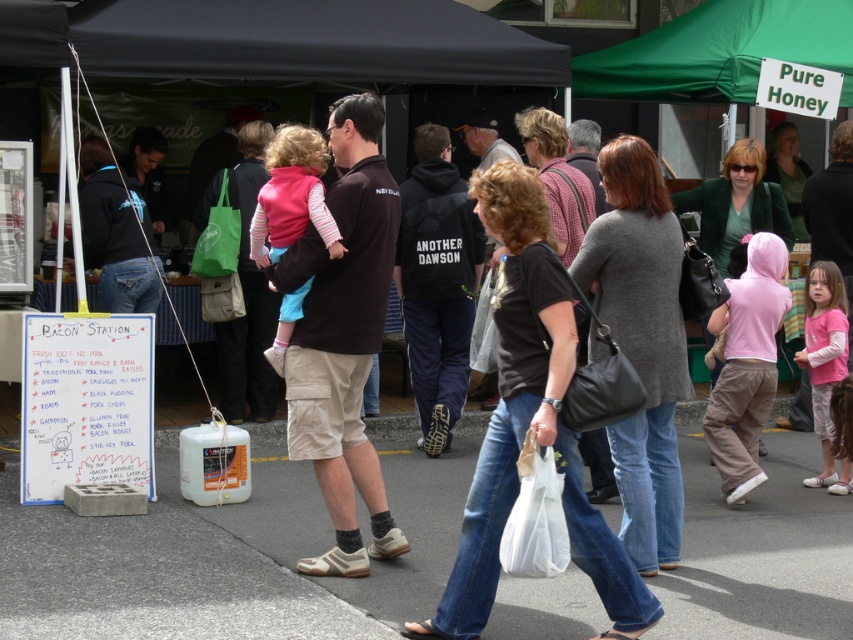
Does gray asphalt pavement at lower center lie behind gray knitted sweater at center?

That is False.

Is gray asphalt pavement at lower center thinner than gray knitted sweater at center?

No.

Between point (465, 445) and point (660, 179), which one is positioned behind?

The point (465, 445) is more distant.

The image size is (853, 640). What are the coordinates of `gray asphalt pavement at lower center` in the screenshot? It's located at click(x=225, y=557).

Based on the photo, can you confirm if gray asphalt pavement at lower center is wider than green matte jacket at upper center?

Indeed, gray asphalt pavement at lower center has a greater width compared to green matte jacket at upper center.

Looking at this image, between gray asphalt pavement at lower center and green matte jacket at upper center, which one is positioned lower?

gray asphalt pavement at lower center

Does point (0, 534) come farther from viewer compared to point (778, 148)?

No, it is in front of (778, 148).

I want to click on gray asphalt pavement at lower center, so click(x=225, y=557).

Describe the element at coordinates (531, 422) in the screenshot. This screenshot has height=640, width=853. I see `black cotton shirt at center` at that location.

Which is above, black cotton shirt at center or green matte jacket at upper center?

→ Positioned higher is green matte jacket at upper center.

I want to click on black cotton shirt at center, so click(x=531, y=422).

Locate an element on the screen. The width and height of the screenshot is (853, 640). black cotton shirt at center is located at coordinates (531, 422).